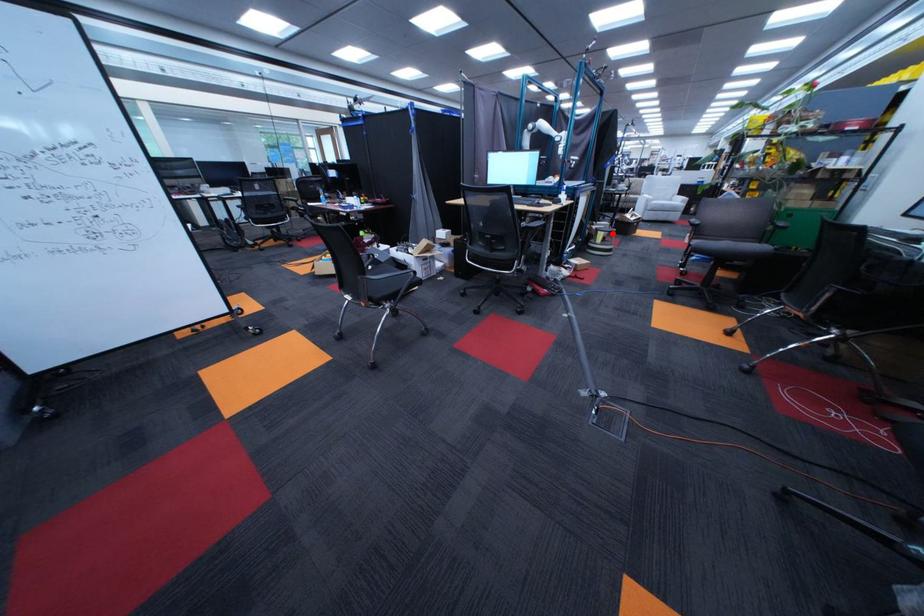
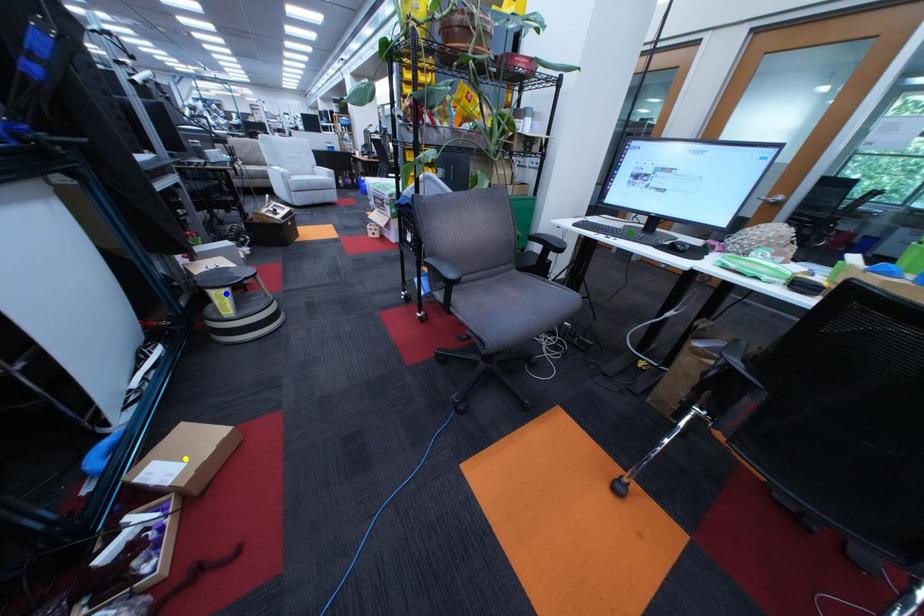
Question: I am providing you with two images of the same scene from different viewpoints. A red point is marked on the first image. You are given multiple points on the second image. Which point in image 2 is actually the same real-world point as the red point in image 1?

Choices:
 (A) green point
 (B) yellow point
 (C) blue point

Answer: (C)